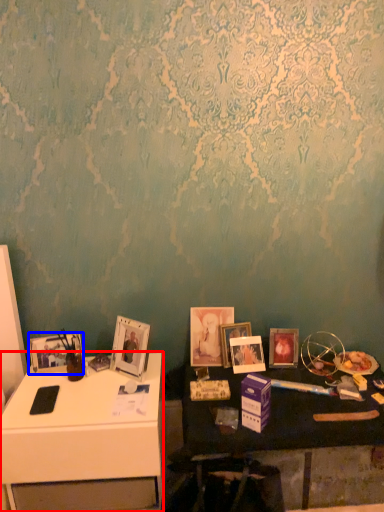
Question: Which of the following is the closest to the observer, desk (highlighted by a red box) or picture frame (highlighted by a blue box)?

Choices:
 (A) desk
 (B) picture frame

Answer: (A)